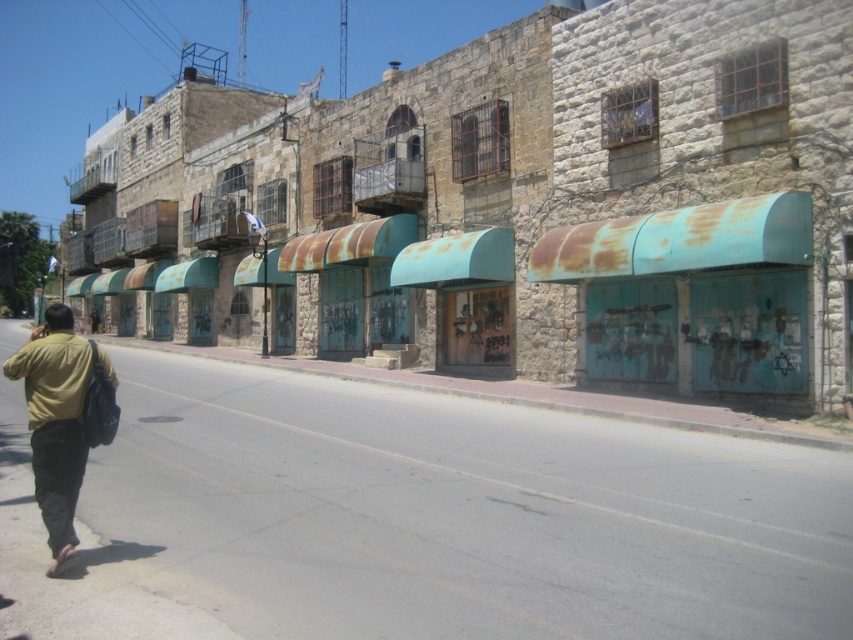
You are a delivery person who needs to choose a jacket to protect yourself from the rain. Both the yellow matte jacket at lower left and the dark brown leather jacket at lower left are available. Which jacket would be more suitable based on their sizes?

The yellow matte jacket at lower left is larger in size than the dark brown leather jacket at lower left, so it would be more suitable for protection from the rain as it offers more coverage.